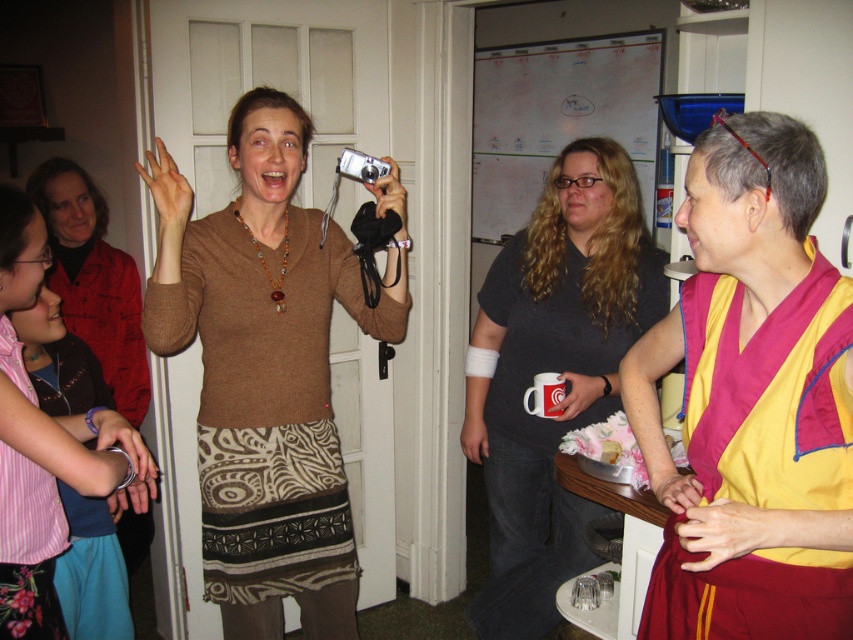
Which is behind, point (367, 314) or point (12, 605)?

The point (367, 314) is more distant.

Identify the location of brown sweater at center. The image size is (853, 640). (x=268, y=369).

Is point (289, 356) positioned in front of point (4, 227)?

No, (289, 356) is behind (4, 227).

Where is `brown sweater at center`? This screenshot has width=853, height=640. brown sweater at center is located at coordinates (268, 369).

Measure the distance between point (158, 195) and camera.

The distance of point (158, 195) from camera is 1.67 meters.

Is brown sweater at center in front of dark gray t-shirt at center?

Yes.

Locate an element on the screen. The height and width of the screenshot is (640, 853). brown sweater at center is located at coordinates point(268,369).

The width and height of the screenshot is (853, 640). Find the location of `brown sweater at center`. brown sweater at center is located at coordinates (268, 369).

Is maroon silk robe at right smaller than dark gray t-shirt at center?

Yes.

Does point (815, 582) come closer to viewer compared to point (624, 176)?

Yes, it is in front of point (624, 176).

Identify the location of maroon silk robe at right. (752, 401).